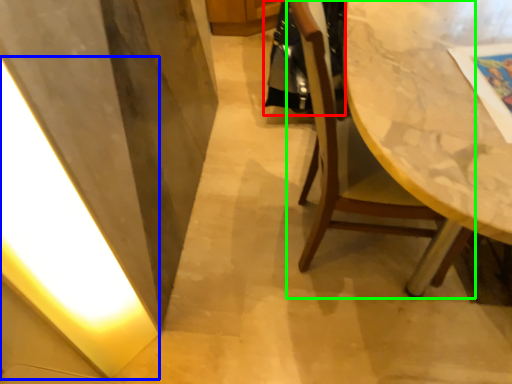
Question: Estimate the real-world distances between objects in this image. Which object is farther from robe (highlighted by a red box), light (highlighted by a blue box) or chair (highlighted by a green box)?

Choices:
 (A) light
 (B) chair

Answer: (A)